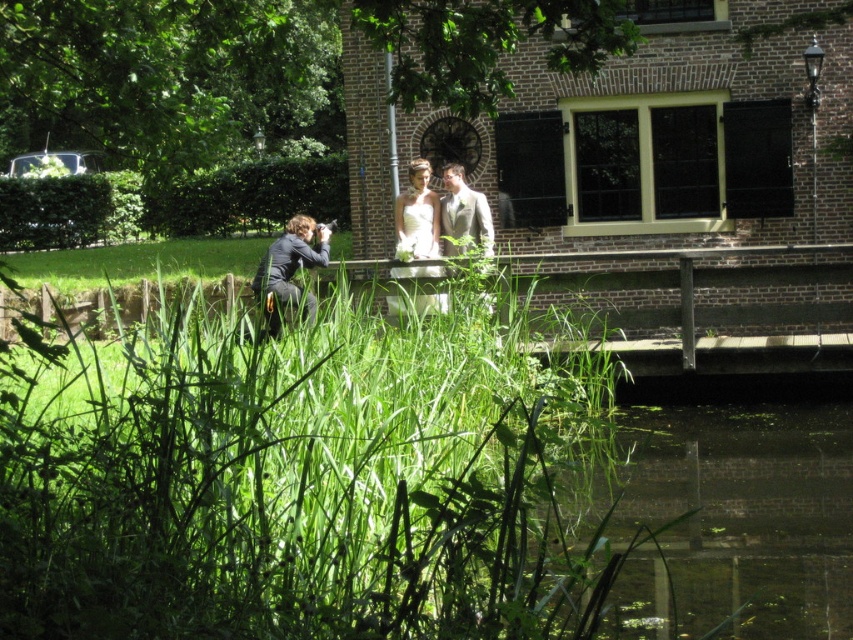
Is matte black suit at lower left in front of light beige textured suit at center?

No, matte black suit at lower left is behind light beige textured suit at center.

Between matte black suit at lower left and light beige textured suit at center, which one appears on the right side from the viewer's perspective?

light beige textured suit at center

Who is more forward, (289, 301) or (456, 193)?

Positioned in front is point (289, 301).

Identify the location of matte black suit at lower left. (288, 266).

Which is above, white satin dress at upper center or matte black suit at lower left?

white satin dress at upper center is above.

Who is more distant from viewer, (416, 241) or (265, 301)?

The point (416, 241) is more distant.

Locate an element on the screen. The width and height of the screenshot is (853, 640). white satin dress at upper center is located at coordinates (416, 216).

Which is more to the left, green leafy grass at lower center or matte black suit at lower left?

From the viewer's perspective, matte black suit at lower left appears more on the left side.

Does green leafy grass at lower center have a greater height compared to matte black suit at lower left?

Yes, green leafy grass at lower center is taller than matte black suit at lower left.

Describe the element at coordinates (292, 481) in the screenshot. I see `green leafy grass at lower center` at that location.

Image resolution: width=853 pixels, height=640 pixels. I want to click on green leafy grass at lower center, so click(292, 481).